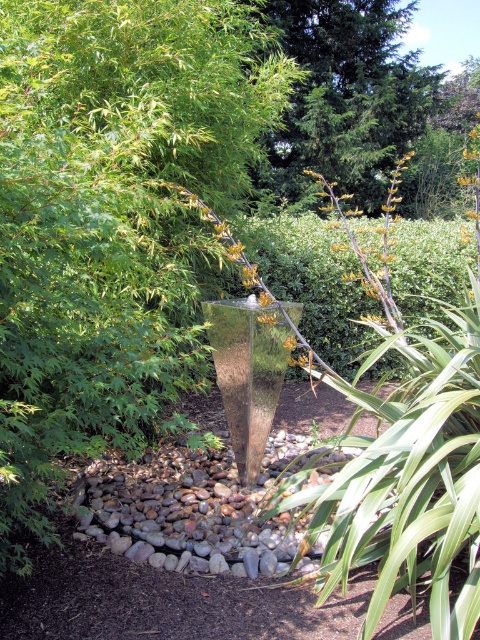
You are standing in the garden and want to take a photo of the fountain. To ensure the green textured tree at upper center is in the background, where should you position yourself relative to the fountain?

Position yourself so the fountain is between you and the green textured tree at upper center. Since the tree is located at coordinates [344,100], placing the fountain between you and the tree will keep it in the background.